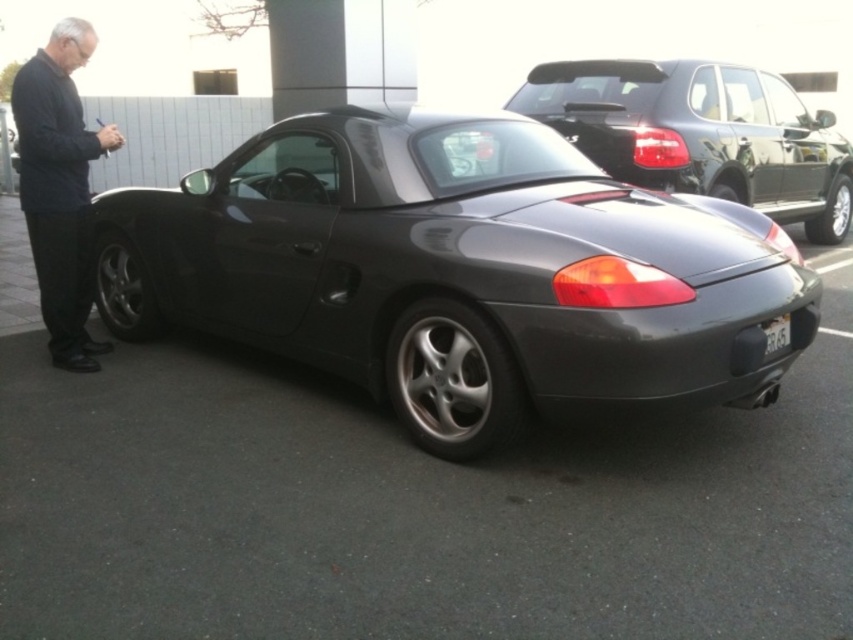
You are a photographer trying to capture the satin black sports car at center and the dark gray sweater at left in a single shot. Which object should you focus on first to ensure both are in sharp focus?

The satin black sports car at center is closer to the viewer than the dark gray sweater at left. To ensure both are in sharp focus, you should focus on the satin black sports car at center first, as it is the closer object.